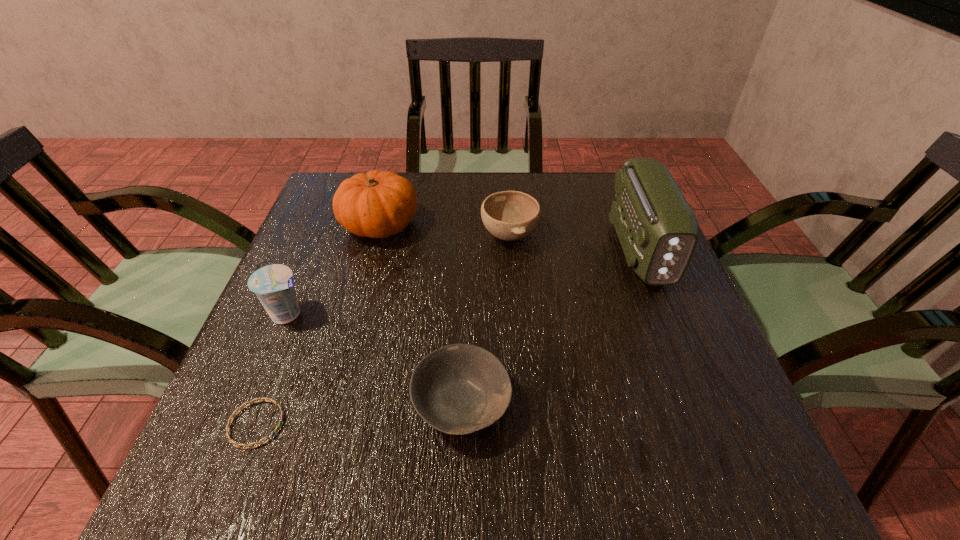
This screenshot has width=960, height=540. Find the location of `free space between the tallest object and the shorter bowl`. free space between the tallest object and the shorter bowl is located at coordinates (551, 327).

Find the location of a particular element. This screenshot has height=540, width=960. free space between the third tallest object and the shorter bowl is located at coordinates (375, 359).

The width and height of the screenshot is (960, 540). In order to click on empty space between the taller bowl and the radio_receiver in this screenshot , I will do `click(574, 241)`.

This screenshot has height=540, width=960. In order to click on free space between the nearer bowl and the pumpkin in this screenshot , I will do `click(421, 315)`.

Where is `object that ranks as the fourth closest to the second tallest object`? object that ranks as the fourth closest to the second tallest object is located at coordinates tap(232, 441).

Select which object appears as the third closest to the rightmost object. Please provide its 2D coordinates. Your answer should be formatted as a tuple, i.e. [(x, y)], where the tuple contains the x and y coordinates of a point satisfying the conditions above.

[(377, 204)]

Where is `free spot that satisfies the following two spatial constraints: 1. on the front side of the fifth tallest object; 2. on the left side of the third tallest object`? The image size is (960, 540). free spot that satisfies the following two spatial constraints: 1. on the front side of the fifth tallest object; 2. on the left side of the third tallest object is located at coordinates (252, 404).

What are the coordinates of `free location that satisfies the following two spatial constraints: 1. on the back side of the nearer bowl; 2. on the right side of the farther bowl` in the screenshot? It's located at (468, 234).

Find the location of `blank area in the image that satisfies the following two spatial constraints: 1. on the front side of the second tallest object; 2. on the surface of the bracelet showing star-shaped elements`. blank area in the image that satisfies the following two spatial constraints: 1. on the front side of the second tallest object; 2. on the surface of the bracelet showing star-shaped elements is located at coordinates (327, 424).